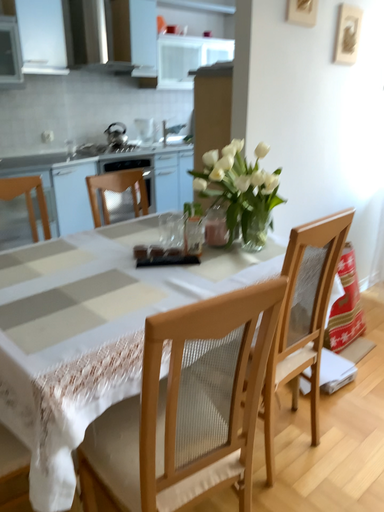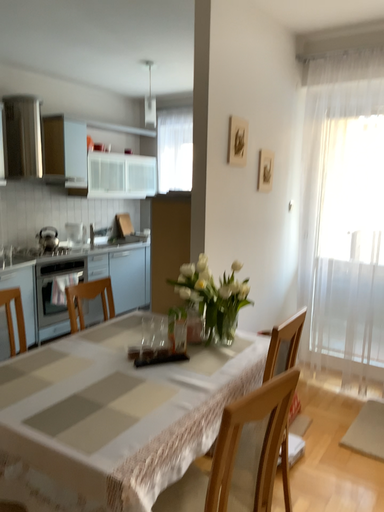
Question: Which way did the camera rotate in the video?

Choices:
 (A) rotated upward
 (B) rotated downward

Answer: (A)